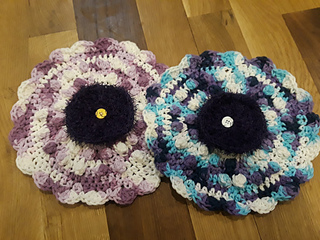
The image size is (320, 240). Identify the location of darker brown wood floor. (161, 222).